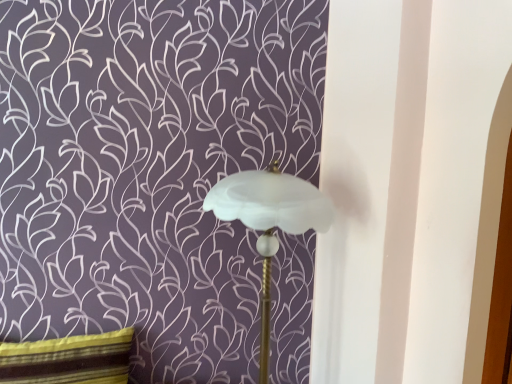
The image size is (512, 384). I want to click on white frosted glass lampshade at center, so pos(269,221).

What do you see at coordinates (269, 221) in the screenshot?
I see `white frosted glass lampshade at center` at bounding box center [269, 221].

This screenshot has height=384, width=512. Describe the element at coordinates (68, 360) in the screenshot. I see `striped fabric pillow at lower left` at that location.

The width and height of the screenshot is (512, 384). Identify the location of striped fabric pillow at lower left. pyautogui.click(x=68, y=360).

Looking at this image, measure the distance between striped fabric pillow at lower left and camera.

striped fabric pillow at lower left and camera are 4.77 feet apart.

Image resolution: width=512 pixels, height=384 pixels. Find the location of `white frosted glass lampshade at center`. white frosted glass lampshade at center is located at coordinates (269, 221).

Considering the positions of objects white frosted glass lampshade at center and striped fabric pillow at lower left in the image provided, who is more to the right, white frosted glass lampshade at center or striped fabric pillow at lower left?

white frosted glass lampshade at center.

Consider the image. Who is more distant, white frosted glass lampshade at center or striped fabric pillow at lower left?

striped fabric pillow at lower left.

Considering the points (312, 205) and (70, 362), which point is behind, point (312, 205) or point (70, 362)?

The point (70, 362) is farther.

Looking at this image, from the image's perspective, which is below, white frosted glass lampshade at center or striped fabric pillow at lower left?

striped fabric pillow at lower left.

Consider the image. From a real-world perspective, which object stands above the other?

white frosted glass lampshade at center.

Consider the image. Considering the relative sizes of white frosted glass lampshade at center and striped fabric pillow at lower left in the image provided, is white frosted glass lampshade at center thinner than striped fabric pillow at lower left?

Incorrect, the width of white frosted glass lampshade at center is not less than that of striped fabric pillow at lower left.

Is white frosted glass lampshade at center taller than striped fabric pillow at lower left?

Correct, white frosted glass lampshade at center is much taller as striped fabric pillow at lower left.

Can you confirm if white frosted glass lampshade at center is bigger than striped fabric pillow at lower left?

Indeed, white frosted glass lampshade at center has a larger size compared to striped fabric pillow at lower left.

Is white frosted glass lampshade at center located outside striped fabric pillow at lower left?

white frosted glass lampshade at center is positioned outside striped fabric pillow at lower left.

Based on the photo, is white frosted glass lampshade at center not close to striped fabric pillow at lower left?

No, white frosted glass lampshade at center is not far away from striped fabric pillow at lower left.

Is white frosted glass lampshade at center oriented towards striped fabric pillow at lower left?

No.

Can you tell me how much white frosted glass lampshade at center and striped fabric pillow at lower left differ in facing direction?

There is a 0.0987-degree angle between the facing directions of white frosted glass lampshade at center and striped fabric pillow at lower left.

Locate an element on the screen. This screenshot has width=512, height=384. pillow below the white frosted glass lampshade at center (from the image's perspective) is located at coordinates (68, 360).

Is striped fabric pillow at lower left to the left or to the right of white frosted glass lampshade at center in the image?

striped fabric pillow at lower left is to the left of white frosted glass lampshade at center.

Is striped fabric pillow at lower left positioned behind white frosted glass lampshade at center?

Yes.

Which is farther from the camera, (78, 359) or (275, 248)?

The point (78, 359) is behind.

From the image's perspective, which is below, striped fabric pillow at lower left or white frosted glass lampshade at center?

striped fabric pillow at lower left appears lower in the image.

From a real-world perspective, between striped fabric pillow at lower left and white frosted glass lampshade at center, who is vertically lower?

From a 3D spatial view, striped fabric pillow at lower left is below.

Which of these two, striped fabric pillow at lower left or white frosted glass lampshade at center, is thinner?

striped fabric pillow at lower left.

Is striped fabric pillow at lower left shorter than white frosted glass lampshade at center?

Yes.

Considering the sizes of objects striped fabric pillow at lower left and white frosted glass lampshade at center in the image provided, who is smaller, striped fabric pillow at lower left or white frosted glass lampshade at center?

With smaller size is striped fabric pillow at lower left.

Is striped fabric pillow at lower left outside of white frosted glass lampshade at center?

Indeed, striped fabric pillow at lower left is completely outside white frosted glass lampshade at center.

Is striped fabric pillow at lower left next to white frosted glass lampshade at center?

No.

Is striped fabric pillow at lower left positioned with its back to white frosted glass lampshade at center?

No, striped fabric pillow at lower left is not facing away from white frosted glass lampshade at center.

How much distance is there between striped fabric pillow at lower left and white frosted glass lampshade at center?

striped fabric pillow at lower left and white frosted glass lampshade at center are 28.61 inches apart.

In the image, there is a striped fabric pillow at lower left. Where is `lamp above it (from the image's perspective)`? The width and height of the screenshot is (512, 384). lamp above it (from the image's perspective) is located at coordinates (269, 221).

Identify the location of pillow that appears below the white frosted glass lampshade at center (from the image's perspective). (68, 360).

At what (x,y) coordinates should I click in order to perform the action: click on pillow behind the white frosted glass lampshade at center. Please return your answer as a coordinate pair (x, y). The image size is (512, 384). Looking at the image, I should click on (68, 360).